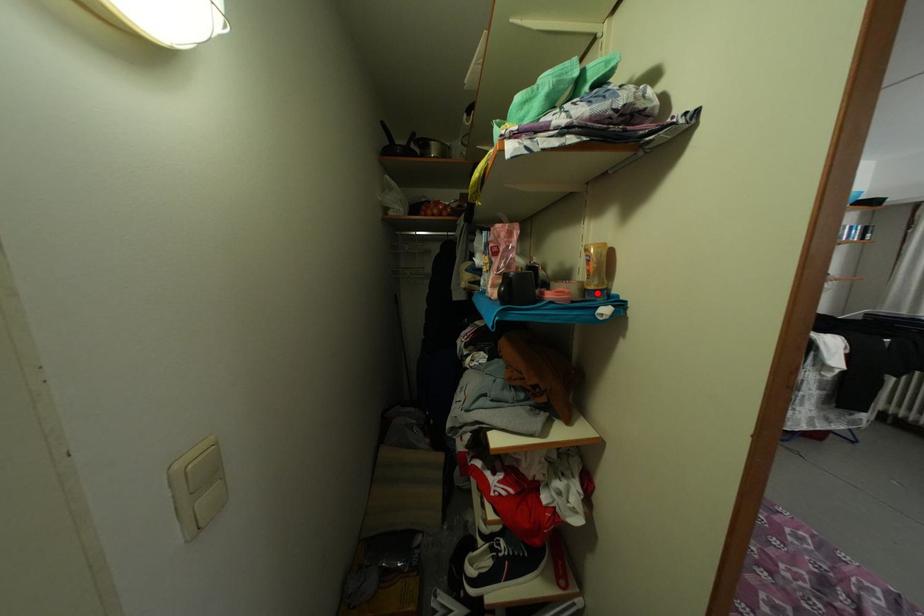
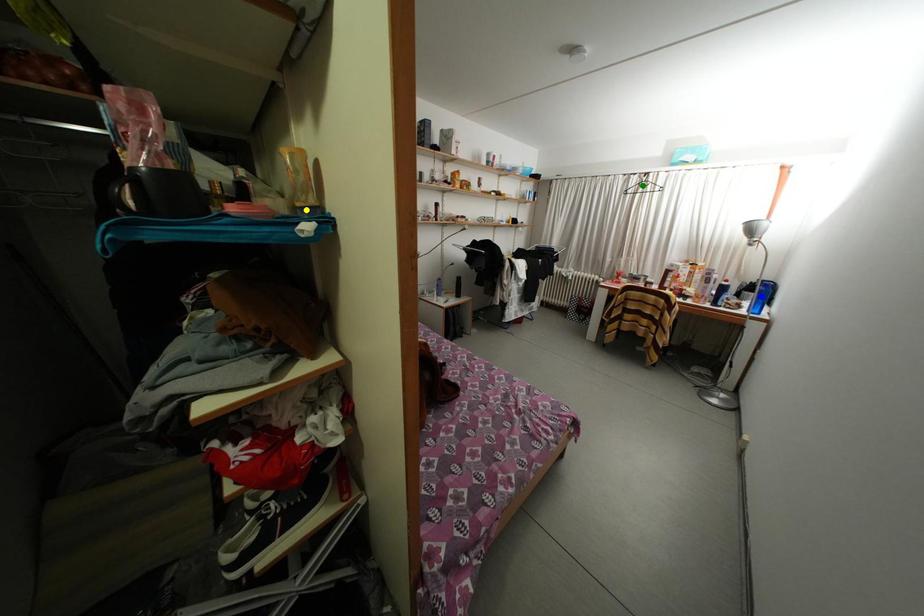
Question: I am providing you with two images of the same scene from different viewpoints. A red point is marked on the first image. You are given multiple points on the second image. Which point in image 2 is actually the same real-world point as the red point in image 1?

Choices:
 (A) blue point
 (B) yellow point
 (C) green point

Answer: (B)